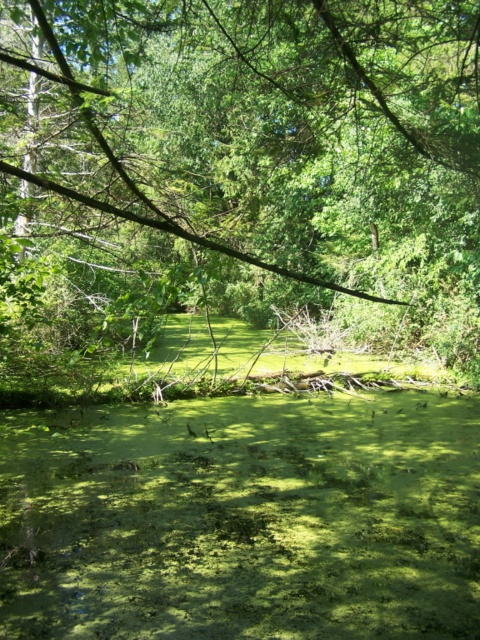
Question: Is green leafy tree at center to the left of green algae at center from the viewer's perspective?

Choices:
 (A) yes
 (B) no

Answer: (A)

Question: Is green leafy tree at center positioned in front of green algae at center?

Choices:
 (A) no
 (B) yes

Answer: (B)

Question: Considering the relative positions of green leafy tree at center and green algae at center in the image provided, where is green leafy tree at center located with respect to green algae at center?

Choices:
 (A) left
 (B) right

Answer: (A)